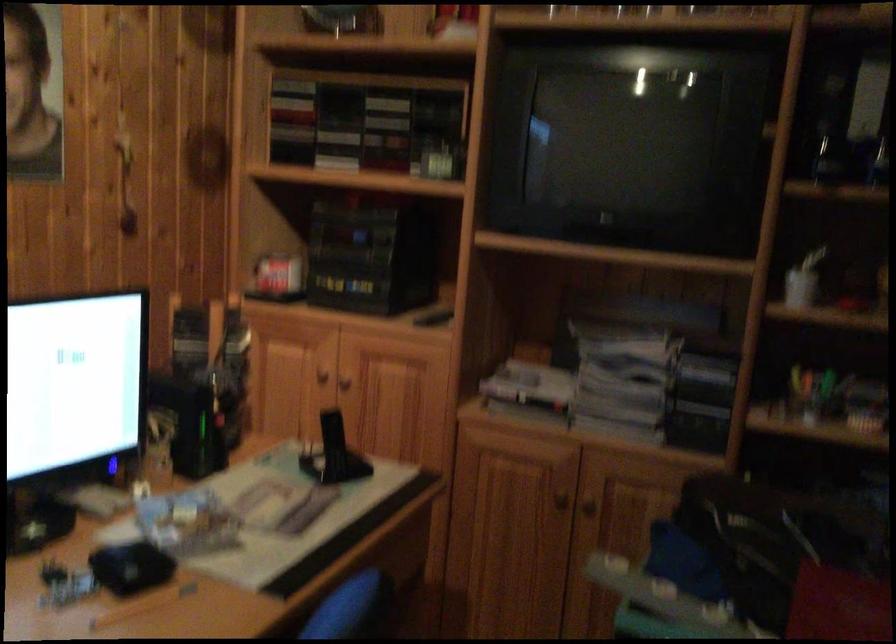
Question: How did the camera likely rotate?

Choices:
 (A) Left
 (B) Right
 (C) Up
 (D) Down

Answer: (B)